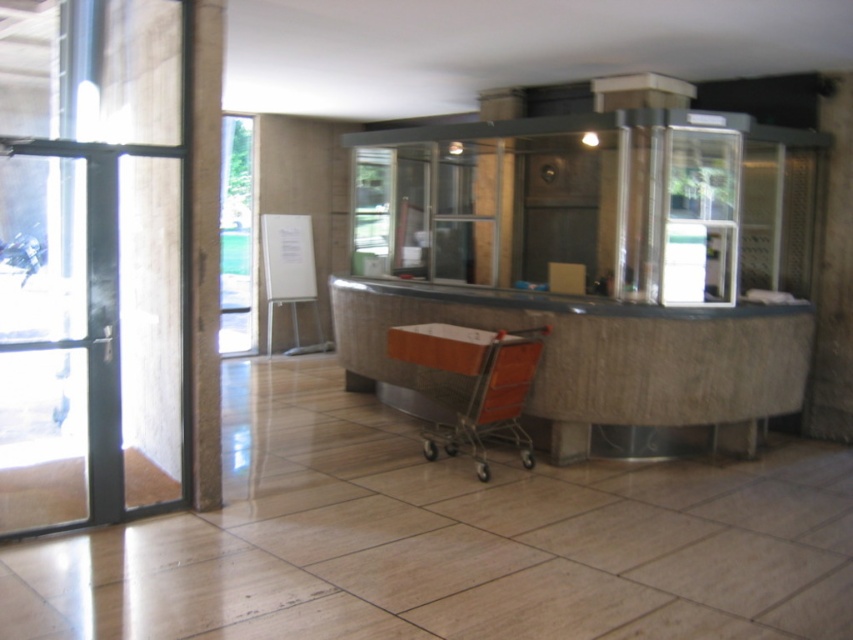
Question: Does transparent glass door at left lie in front of wooden/metallic shopping cart at center?

Choices:
 (A) no
 (B) yes

Answer: (B)

Question: Is transparent glass door at left to the left of wooden/metallic shopping cart at center from the viewer's perspective?

Choices:
 (A) yes
 (B) no

Answer: (A)

Question: Is the position of transparent glass door at left more distant than that of wooden/metallic shopping cart at center?

Choices:
 (A) yes
 (B) no

Answer: (B)

Question: Among these points, which one is nearest to the camera?

Choices:
 (A) (30, 280)
 (B) (399, 333)

Answer: (B)